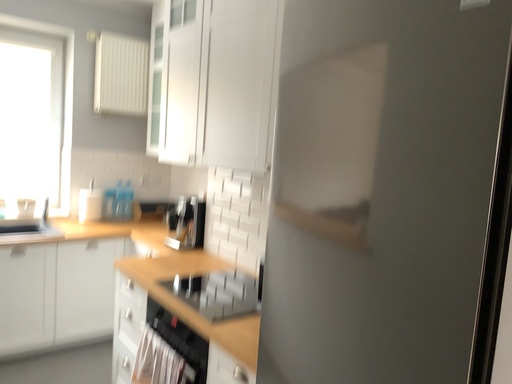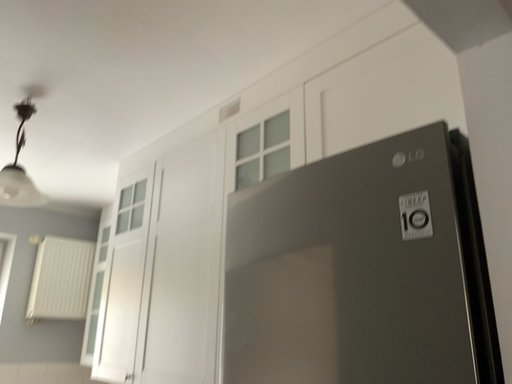
Question: Which way did the camera rotate in the video?

Choices:
 (A) rotated upward
 (B) rotated downward

Answer: (A)